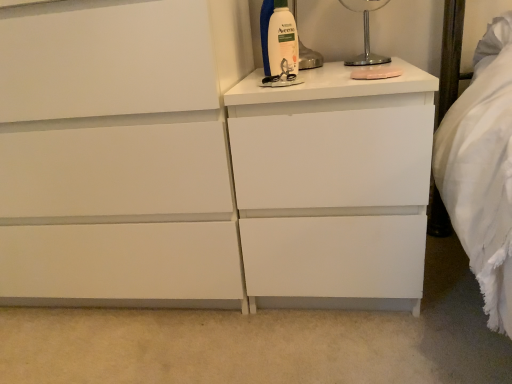
Question: In the image, is white matte chest of drawers at center on the left side or the right side of white plastic bottle at upper right?

Choices:
 (A) right
 (B) left

Answer: (B)

Question: From the image's perspective, is white matte chest of drawers at center positioned above or below white plastic bottle at upper right?

Choices:
 (A) above
 (B) below

Answer: (B)

Question: Considering the real-world distances, which object is farthest from the white plastic bottle at upper right?

Choices:
 (A) white matte nightstand at center
 (B) metallic silver lamp at upper right
 (C) white matte chest of drawers at center

Answer: (C)

Question: Estimate the real-world distances between objects in this image. Which object is closer to the white matte nightstand at center?

Choices:
 (A) white matte chest of drawers at center
 (B) white plastic bottle at upper right
 (C) metallic silver lamp at upper right

Answer: (A)